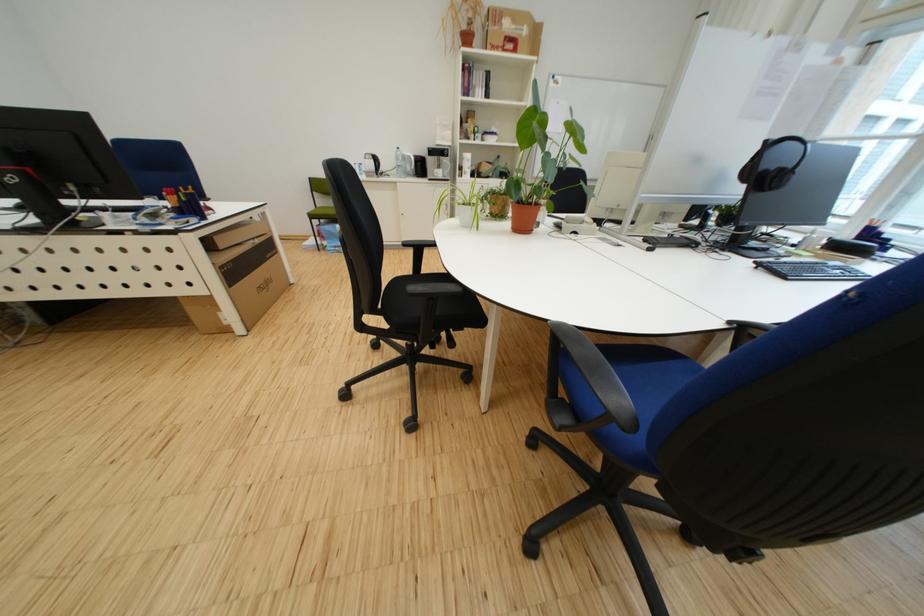
In order to click on green chair sitting surface in this screenshot , I will do `click(322, 214)`.